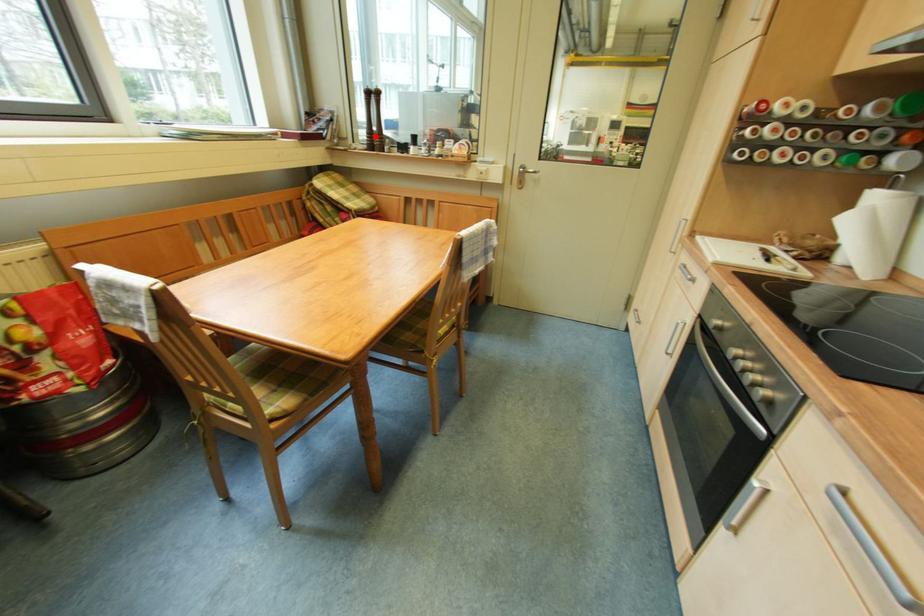
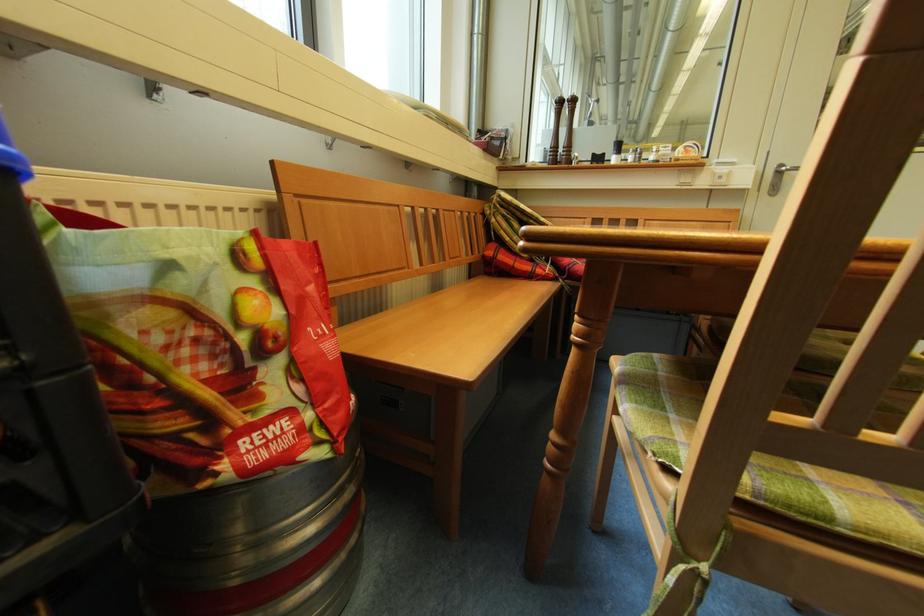
Question: I am providing you with two images of the same scene from different viewpoints. A red point is marked on the first image. Can you still see the location of the red point in image 2?

Choices:
 (A) Yes
 (B) No

Answer: (A)